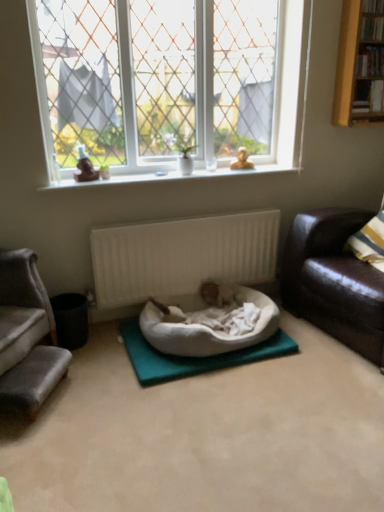
Find the location of a particular element. vacant space to the right of black matte trash bin at lower left is located at coordinates (109, 343).